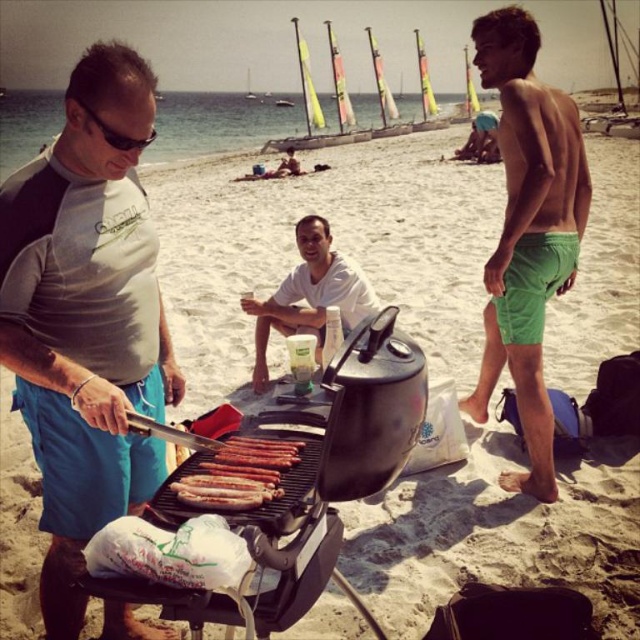
Question: Which point is farther to the camera?

Choices:
 (A) green cotton shorts at right
 (B) gray-blue rash guard at left
 (C) black plastic goggles at upper left
 (D) brown glossy sausages at center

Answer: (A)

Question: Which of the following is the closest to the observer?

Choices:
 (A) (152, 131)
 (B) (317, 360)
 (C) (520, 68)
 (D) (234, 451)

Answer: (A)

Question: Among these objects, which one is nearest to the camera?

Choices:
 (A) gray-blue rash guard at left
 (B) white matte shirt at center
 (C) black plastic goggles at upper left
 (D) brown glossy sausages at center

Answer: (D)

Question: Does green cotton shorts at right appear under brown glossy sausages at center?

Choices:
 (A) no
 (B) yes

Answer: (A)

Question: Is gray-blue rash guard at left smaller than white matte shirt at center?

Choices:
 (A) yes
 (B) no

Answer: (B)

Question: Does gray-blue rash guard at left have a lesser width compared to white matte shirt at center?

Choices:
 (A) no
 (B) yes

Answer: (B)